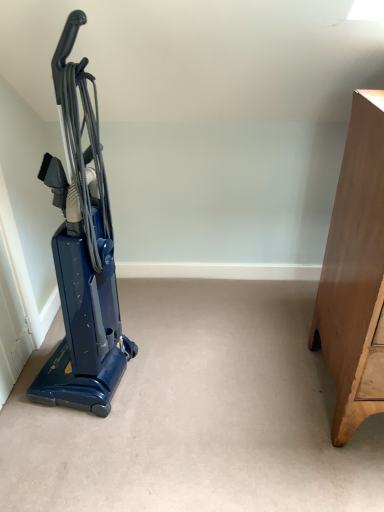
Question: Is blue glossy vacuum cleaner at left wider or thinner than light brown wooden dresser at right?

Choices:
 (A) thin
 (B) wide

Answer: (A)

Question: From a real-world perspective, is blue glossy vacuum cleaner at left positioned above or below light brown wooden dresser at right?

Choices:
 (A) above
 (B) below

Answer: (A)

Question: Relative to light brown wooden dresser at right, is blue glossy vacuum cleaner at left in front or behind?

Choices:
 (A) front
 (B) behind

Answer: (B)

Question: From their relative heights in the image, would you say light brown wooden dresser at right is taller or shorter than blue glossy vacuum cleaner at left?

Choices:
 (A) tall
 (B) short

Answer: (B)

Question: Is light brown wooden dresser at right in front of or behind blue glossy vacuum cleaner at left in the image?

Choices:
 (A) front
 (B) behind

Answer: (A)

Question: From a real-world perspective, is light brown wooden dresser at right physically located above or below blue glossy vacuum cleaner at left?

Choices:
 (A) below
 (B) above

Answer: (A)

Question: From the image's perspective, relative to blue glossy vacuum cleaner at left, is light brown wooden dresser at right above or below?

Choices:
 (A) above
 (B) below

Answer: (B)